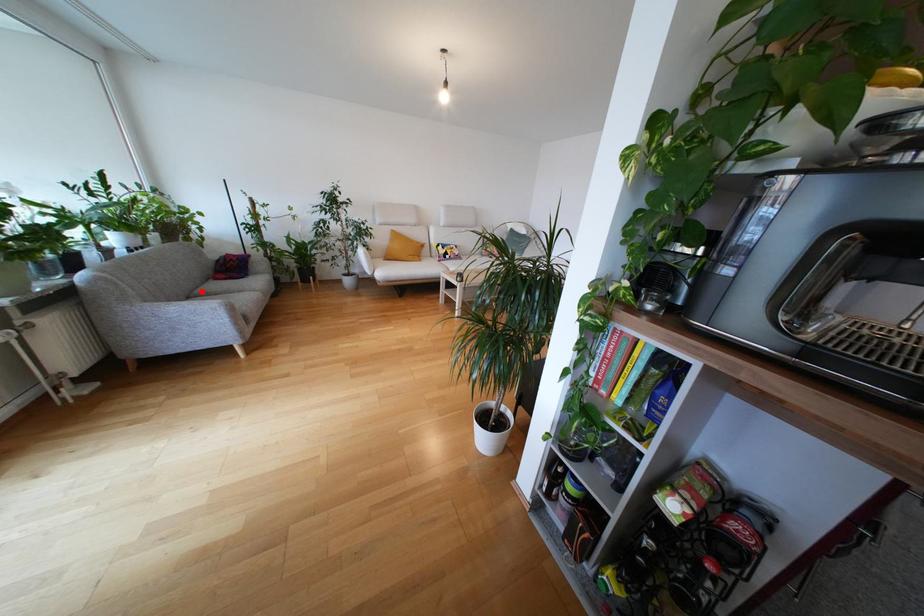
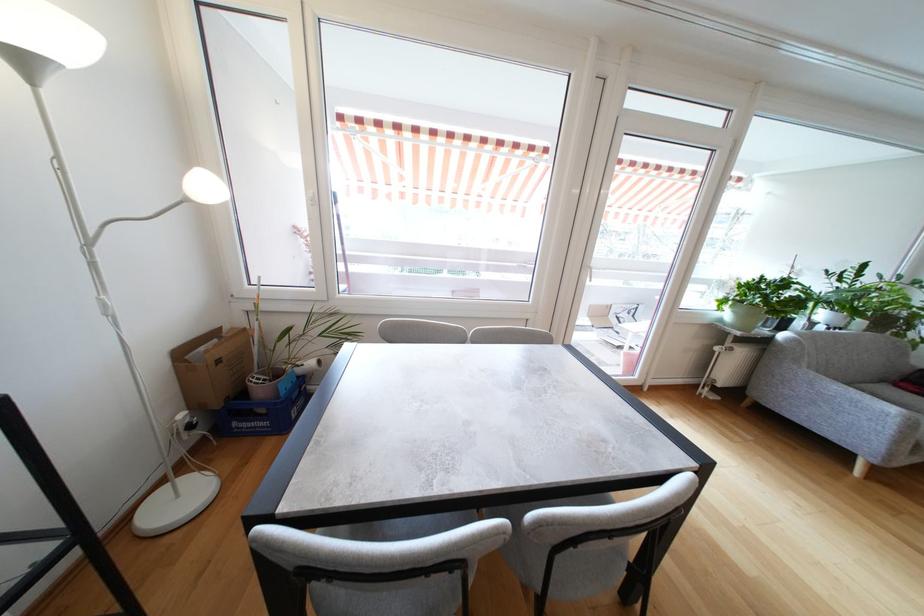
The point at the highlighted location is marked in the first image. Where is the corresponding point in the second image?

(866, 387)